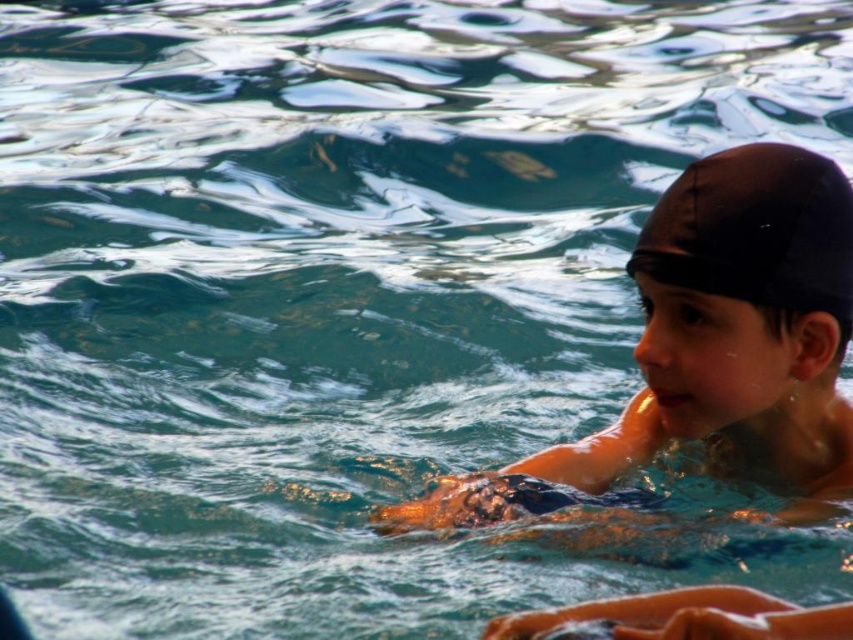
From the picture: Can you confirm if matte black swim cap at upper right is thinner than black matte swim cap at upper right?

No.

Is matte black swim cap at upper right taller than black matte swim cap at upper right?

Correct, matte black swim cap at upper right is much taller as black matte swim cap at upper right.

The width and height of the screenshot is (853, 640). I want to click on matte black swim cap at upper right, so (x=712, y=348).